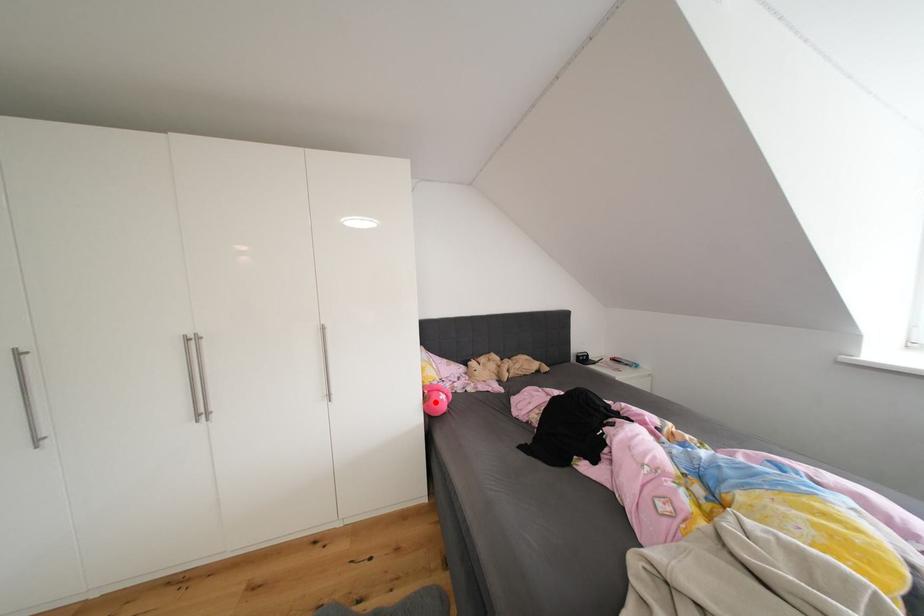
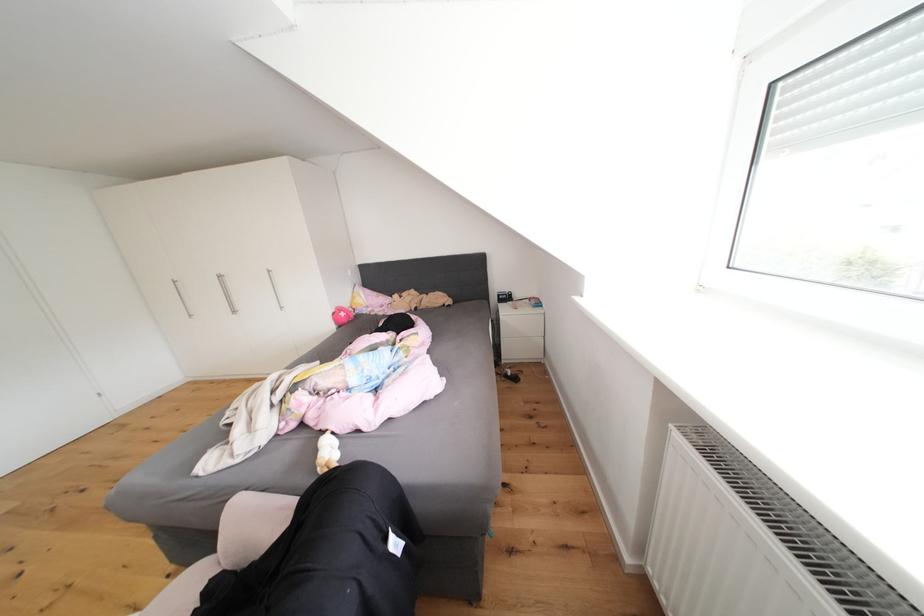
Find the pixel in the second image that matches the highlighted location in the first image.

(343, 318)